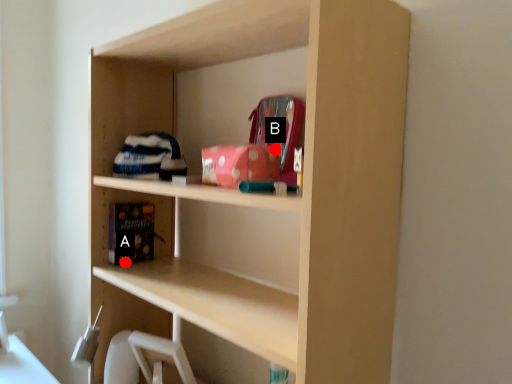
Question: Two points are circled on the image, labeled by A and B beside each circle. Which point appears closest to the camera in this image?

Choices:
 (A) A is closer
 (B) B is closer

Answer: (B)